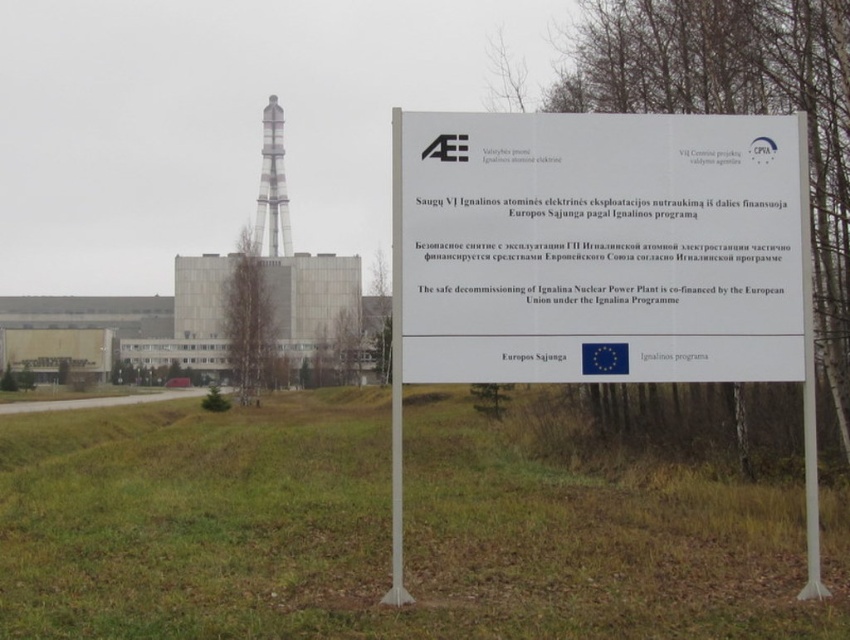
Question: Can you confirm if green grass at center is thinner than white metallic pole at center?

Choices:
 (A) no
 (B) yes

Answer: (A)

Question: Which point is farther to the camera?

Choices:
 (A) white plastic pole at center
 (B) green grass at center
 (C) white paper sign at center
 (D) white metallic pole at center

Answer: (A)

Question: Among these objects, which one is farthest from the camera?

Choices:
 (A) green grass at center
 (B) white metallic pole at center
 (C) white paper sign at center

Answer: (B)

Question: Is white paper sign at center positioned at the back of white metallic pole at center?

Choices:
 (A) no
 (B) yes

Answer: (A)

Question: Which object is positioned closest to the white plastic pole at center?

Choices:
 (A) white metallic pole at center
 (B) white paper sign at center
 (C) green grass at center

Answer: (B)

Question: Is white paper sign at center smaller than white plastic pole at center?

Choices:
 (A) no
 (B) yes

Answer: (A)